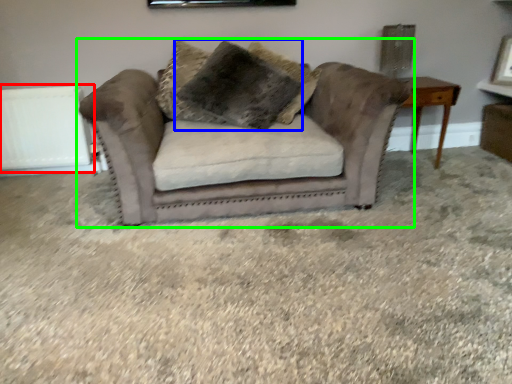
Question: Considering the real-world distances, which object is farthest from radiator (highlighted by a red box)? pillow (highlighted by a blue box) or studio couch (highlighted by a green box)?

Choices:
 (A) pillow
 (B) studio couch

Answer: (B)